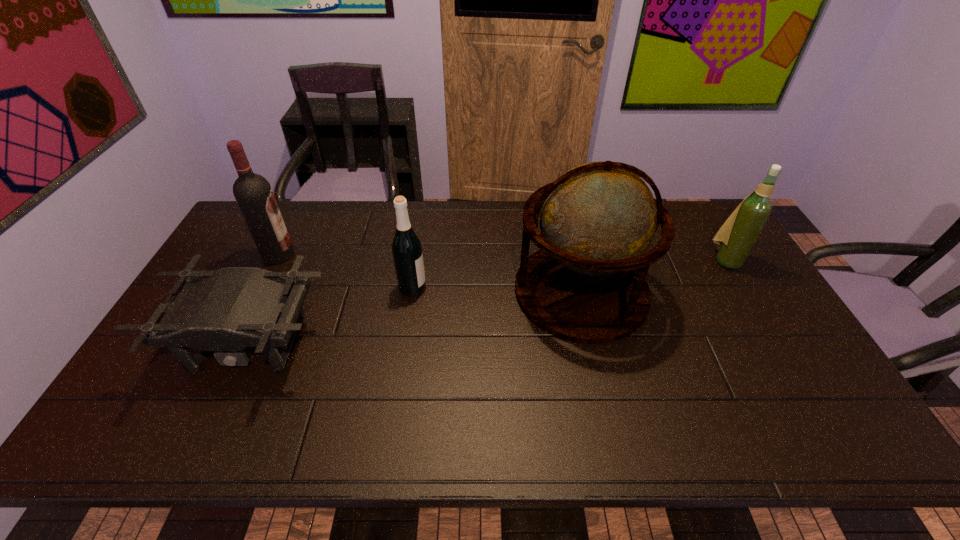
This screenshot has height=540, width=960. Identify the location of blank region between the nearest wine bottle and the shortest object. (331, 315).

Select which object is the third closest to the nearest wine bottle. Please provide its 2D coordinates. Your answer should be formatted as a tuple, i.e. [(x, y)], where the tuple contains the x and y coordinates of a point satisfying the conditions above.

[(253, 193)]

Identify which object is located as the third nearest to the rightmost object. Please provide its 2D coordinates. Your answer should be formatted as a tuple, i.e. [(x, y)], where the tuple contains the x and y coordinates of a point satisfying the conditions above.

[(226, 310)]

Locate an element on the screen. Image resolution: width=960 pixels, height=540 pixels. wine bottle object that ranks as the second closest to the third object from left to right is located at coordinates (735, 239).

Locate an element on the screen. the closest wine bottle to the third object from right to left is located at coordinates (253, 193).

The height and width of the screenshot is (540, 960). I want to click on free point that satisfies the following two spatial constraints: 1. on the label of the second wine bottle from left to right; 2. with a camera mounted on the underside of the shortest object, so click(x=404, y=343).

Locate an element on the screen. The height and width of the screenshot is (540, 960). free spot that satisfies the following two spatial constraints: 1. on the label of the second wine bottle from left to right; 2. with a camera mounted on the underside of the shortest object is located at coordinates (404, 343).

The width and height of the screenshot is (960, 540). Find the location of `free space that satisfies the following two spatial constraints: 1. on the front-facing side of the rightmost wine bottle; 2. on the label of the third object from left to right`. free space that satisfies the following two spatial constraints: 1. on the front-facing side of the rightmost wine bottle; 2. on the label of the third object from left to right is located at coordinates (742, 288).